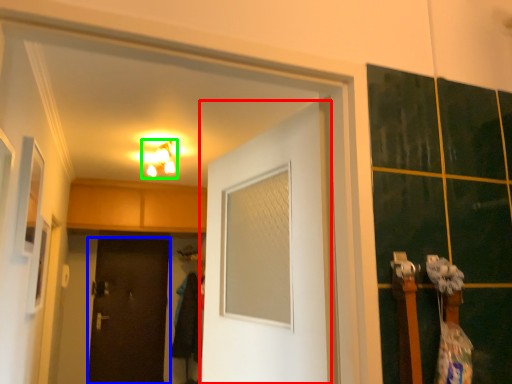
Question: Estimate the real-world distances between objects in this image. Which object is farther from door (highlighted by a red box), door (highlighted by a blue box) or light fixture (highlighted by a green box)?

Choices:
 (A) door
 (B) light fixture

Answer: (A)